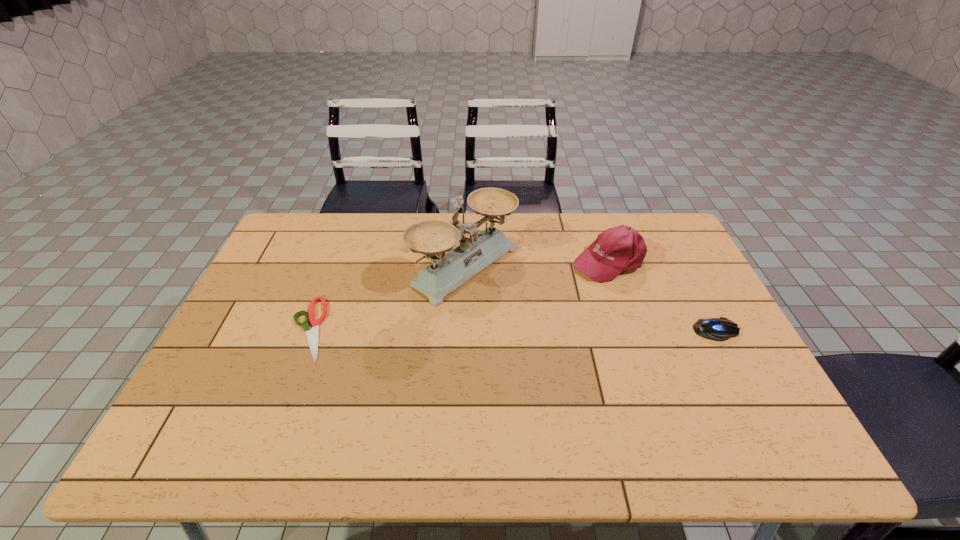
Where is `free space on the desktop that is between the leftmost object and the third tallest object and is positioned at the front of the baseball cap with the brim`? The image size is (960, 540). free space on the desktop that is between the leftmost object and the third tallest object and is positioned at the front of the baseball cap with the brim is located at coordinates (463, 329).

Locate an element on the screen. vacant spot on the desktop that is between the shortest object and the rightmost object and is positioned on the front-facing side of the third object from right to left is located at coordinates (568, 330).